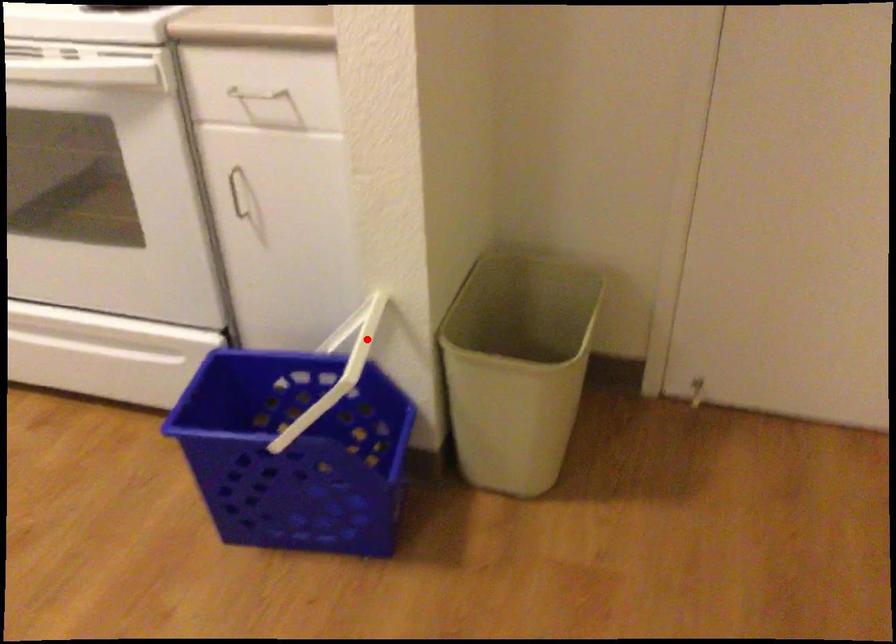
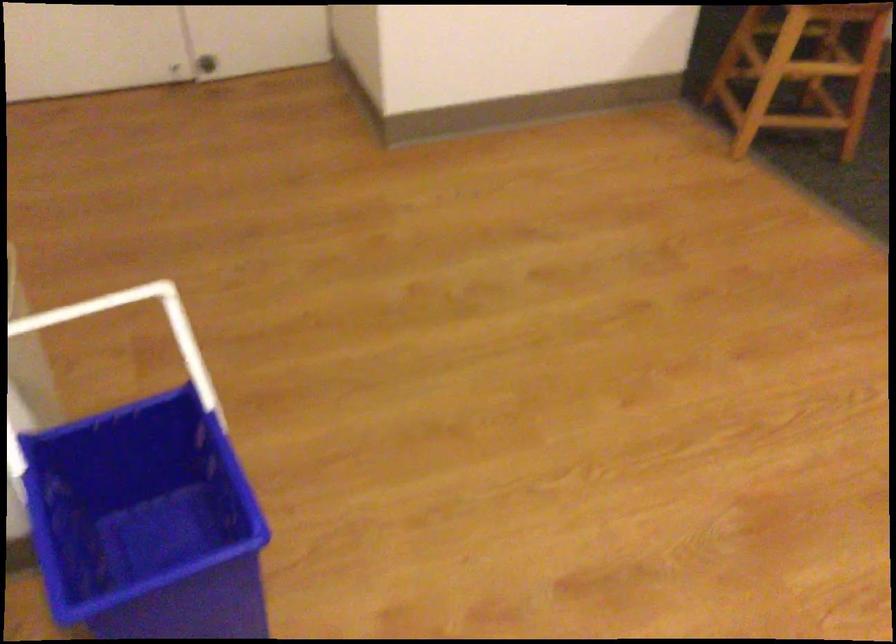
Question: I am providing you with two images of the same scene from different viewpoints. In image1, a red point is highlighted. Considering the same 3D point in image2, which of the following is correct?

Choices:
 (A) It is closer
 (B) It is farther

Answer: (A)